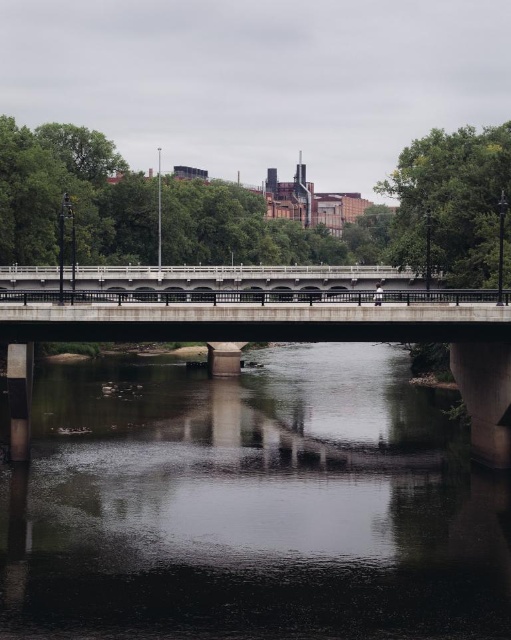
From the picture: Is dark gray concrete river at center bigger than white concrete bridge at center?

Actually, dark gray concrete river at center might be smaller than white concrete bridge at center.

Is dark gray concrete river at center to the left of white concrete bridge at center from the viewer's perspective?

No, dark gray concrete river at center is not to the left of white concrete bridge at center.

You are a GUI agent. You are given a task and a screenshot of the screen. Output one action in this format:
    pyautogui.click(x=<x>, y=<y>)
    Task: Click on the dark gray concrete river at center
    
    Given the screenshot: What is the action you would take?
    pyautogui.click(x=251, y=506)

This screenshot has width=511, height=640. In order to click on dark gray concrete river at center in this screenshot , I will do `click(251, 506)`.

Can you confirm if dark gray concrete river at center is positioned to the left of concrete bridge at center?

In fact, dark gray concrete river at center is to the right of concrete bridge at center.

Does dark gray concrete river at center have a greater height compared to concrete bridge at center?

No, dark gray concrete river at center is not taller than concrete bridge at center.

Where is `dark gray concrete river at center`? The height and width of the screenshot is (640, 511). dark gray concrete river at center is located at coordinates (251, 506).

Between point (11, 324) and point (149, 289), which one is positioned in front?

Point (11, 324) is more forward.

Does concrete bridge at center have a larger size compared to white concrete bridge at center?

Indeed, concrete bridge at center has a larger size compared to white concrete bridge at center.

Is point (159, 269) closer to camera compared to point (323, 291)?

No.

Locate an element on the screen. concrete bridge at center is located at coordinates (261, 326).